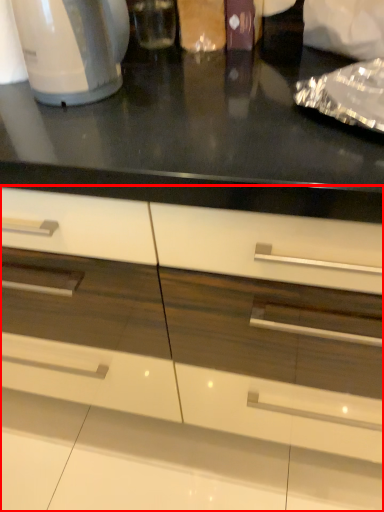
Question: Observing the image, what is the correct spatial positioning of cabinetry (annotated by the red box) in reference to home appliance?

Choices:
 (A) right
 (B) left

Answer: (A)